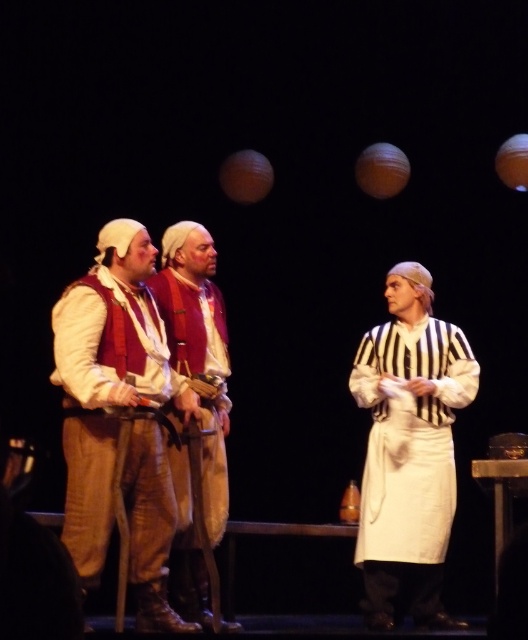
Which of these two, white striped shirt at right or matte brown vest at center, stands shorter?

matte brown vest at center is shorter.

Measure the distance between point (408,525) and camera.

They are 5.93 meters apart.

Identify the location of white striped shirt at right. (410, 451).

From the picture: Can you confirm if white striped shirt at right is smaller than matte red vest at center?

No.

Which is in front, point (391, 273) or point (182, 564)?

Point (182, 564) is in front.

This screenshot has width=528, height=640. What are the coordinates of `white striped shirt at right` in the screenshot? It's located at tap(410, 451).

Does matte brown vest at center appear on the right side of matte red vest at center?

Incorrect, matte brown vest at center is not on the right side of matte red vest at center.

Who is shorter, matte brown vest at center or matte red vest at center?

matte brown vest at center

Does point (88, 476) lie behind point (202, 307)?

That is False.

Identify the location of matte brown vest at center. (99, 400).